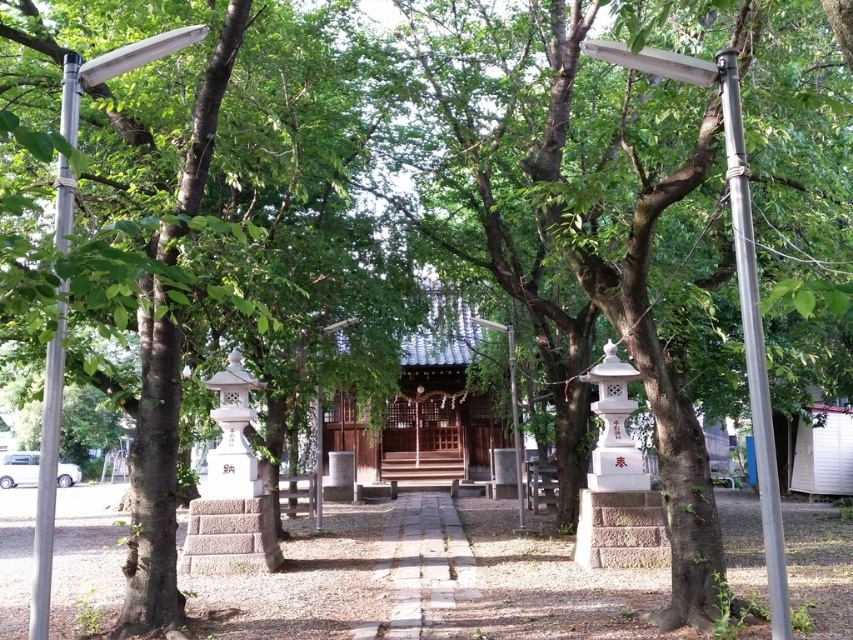
Question: Does metallic pole at right lie behind silver metallic pole at left?

Choices:
 (A) yes
 (B) no

Answer: (A)

Question: Which object appears closest to the camera in this image?

Choices:
 (A) silver metallic pole at left
 (B) metallic pole at center
 (C) metallic pole at right
 (D) metallic silver pole at upper center

Answer: (A)

Question: Does brown wooden hut at center have a lesser width compared to metallic silver pole at upper center?

Choices:
 (A) yes
 (B) no

Answer: (A)

Question: Among these points, which one is farthest from the camera?

Choices:
 (A) (45, 589)
 (B) (753, 362)
 (C) (515, 493)
 (D) (419, 356)

Answer: (D)

Question: Which object is closer to the camera taking this photo?

Choices:
 (A) metallic pole at right
 (B) metallic pole at center
 (C) metallic silver pole at left

Answer: (C)

Question: In this image, where is metallic silver pole at left located relative to metallic pole at right?

Choices:
 (A) below
 (B) above

Answer: (B)